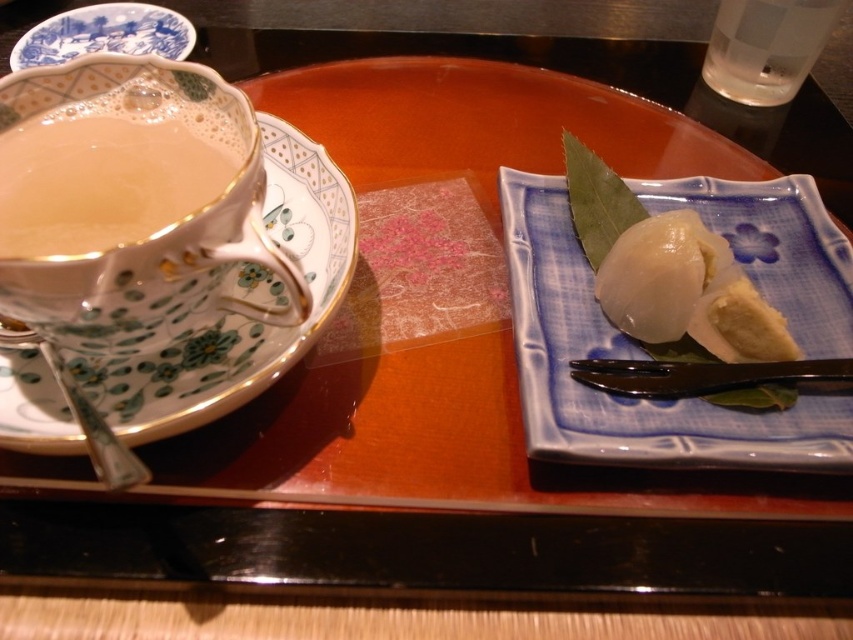
You are a guest at a Japanese tea ceremony and are presented with a wooden tray. You want to reach for the transparent glass at upper right but need to avoid knocking over the white porcelain dumplings at center. Based on their positions, which direction should you move your hand to safely grab the glass?

The white porcelain dumplings at center are to the left of the transparent glass at upper right, so you should move your hand to the right to safely grab the transparent glass at upper right without disturbing the dumplings.

You are a guest at a Japanese tea ceremony and see the white porcelain dumplings at center and the transparent glass at upper right on the tray. Which object is closer to you?

The white porcelain dumplings at center is below the transparent glass at upper right, so the transparent glass at upper right is closer to you.

You are a guest at a Japanese tea ceremony and need to locate the translucent porcelain cup at left on the wooden tray. According to the coordinates provided, where exactly is it positioned on the tray?

The translucent porcelain cup at left is positioned at the coordinates point [109,172] on the wooden tray.